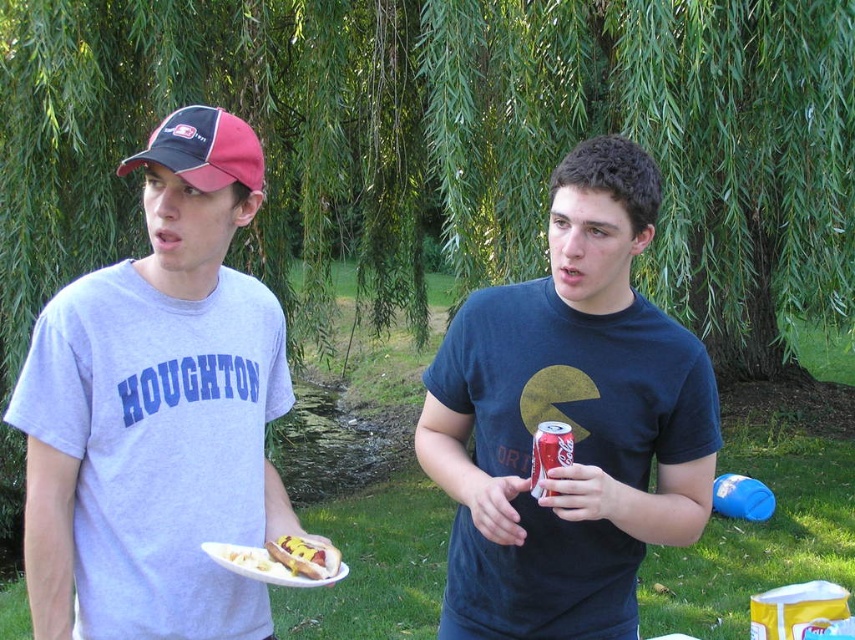
You are a delivery robot that needs to place a 12 inch wide package between the shiny red can at center and the golden crispy hot dog at center. Can you fit it there?

The shiny red can at center and golden crispy hot dog at center are 24.52 inches apart. Since the package is 12 inches wide, there is enough space between them to fit the package.

You are at a picnic and want to know which object is larger between the shiny red can at center and the golden crispy hot dog at center. Can you tell me which one is bigger?

The shiny red can at center is bigger than the golden crispy hot dog at center according to the description.